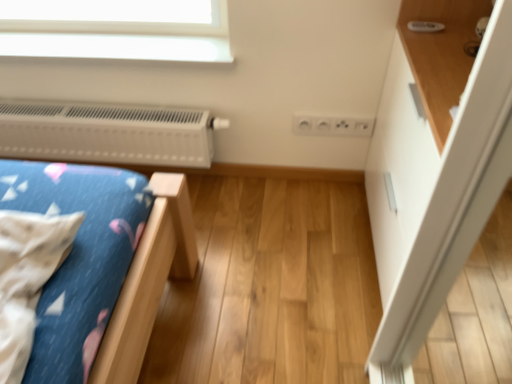
Image resolution: width=512 pixels, height=384 pixels. Describe the element at coordinates (441, 54) in the screenshot. I see `wooden shelf at upper right` at that location.

Find the location of a particular element. This screenshot has width=512, height=384. white glossy dresser at upper right is located at coordinates (414, 169).

At what (x,y) coordinates should I click in order to perform the action: click on white plastic heater at upper left. Please return your answer as a coordinate pair (x, y). Looking at the image, I should click on (108, 133).

Are white glossy dresser at upper right and white plastic heater at upper left located far from each other?

No, white glossy dresser at upper right is in close proximity to white plastic heater at upper left.

From a real-world perspective, is white glossy dresser at upper right positioned over white plastic heater at upper left based on gravity?

Yes, from a real-world perspective, white glossy dresser at upper right is over white plastic heater at upper left

Considering the relative positions of white plastic heater at upper left and wooden shelf at upper right in the image provided, is white plastic heater at upper left in front of wooden shelf at upper right?

No, it is behind wooden shelf at upper right.

Considering the relative sizes of white plastic heater at upper left and wooden shelf at upper right in the image provided, is white plastic heater at upper left shorter than wooden shelf at upper right?

Correct, white plastic heater at upper left is not as tall as wooden shelf at upper right.

Is white plastic heater at upper left positioned far away from wooden shelf at upper right?

Actually, white plastic heater at upper left and wooden shelf at upper right are a little close together.

Does white plastic heater at upper left have a smaller size compared to wooden shelf at upper right?

Correct, white plastic heater at upper left occupies less space than wooden shelf at upper right.

In the scene shown: How much distance is there between white plastic heater at upper left and white glossy dresser at upper right?

The distance of white plastic heater at upper left from white glossy dresser at upper right is 34.56 inches.

Is white plastic heater at upper left at the left side of white glossy dresser at upper right?

Yes.

Is white plastic heater at upper left oriented away from white glossy dresser at upper right?

No, white plastic heater at upper left is not facing away from white glossy dresser at upper right.

Is white plastic heater at upper left not within white glossy dresser at upper right?

That's correct, white plastic heater at upper left is outside of white glossy dresser at upper right.

Could you tell me if white glossy dresser at upper right is facing wooden shelf at upper right?

No.

Which object is further away from the camera taking this photo, white glossy dresser at upper right or wooden shelf at upper right?

Positioned behind is white glossy dresser at upper right.

Who is smaller, white glossy dresser at upper right or wooden shelf at upper right?

Smaller between the two is wooden shelf at upper right.

From the image's perspective, is white glossy dresser at upper right located above wooden shelf at upper right?

No, from the image's perspective, white glossy dresser at upper right is not above wooden shelf at upper right.

Considering the positions of objects wooden shelf at upper right and white glossy dresser at upper right in the image provided, who is more to the right, wooden shelf at upper right or white glossy dresser at upper right?

white glossy dresser at upper right is more to the right.

Is point (462, 60) farther from camera compared to point (446, 152)?

Yes.

Image resolution: width=512 pixels, height=384 pixels. In order to click on shelf above the white glossy dresser at upper right (from the image's perspective) in this screenshot , I will do `click(441, 54)`.

Which object is closer to the camera, wooden shelf at upper right or white glossy dresser at upper right?

Positioned in front is wooden shelf at upper right.

Is wooden shelf at upper right located outside white plastic heater at upper left?

Yes, wooden shelf at upper right is located beyond the bounds of white plastic heater at upper left.

Which of these two, wooden shelf at upper right or white plastic heater at upper left, stands shorter?

Standing shorter between the two is white plastic heater at upper left.

From a real-world perspective, does wooden shelf at upper right sit lower than white plastic heater at upper left?

No.

From the picture: Is wooden shelf at upper right in contact with white plastic heater at upper left?

No, wooden shelf at upper right is not making contact with white plastic heater at upper left.

Identify the location of dresser above the white plastic heater at upper left (from a real-world perspective). The width and height of the screenshot is (512, 384). (414, 169).

At what (x,y) coordinates should I click in order to perform the action: click on shelf above the white plastic heater at upper left (from the image's perspective). Please return your answer as a coordinate pair (x, y). Looking at the image, I should click on [x=441, y=54].

Which object lies nearer to the anchor point white glossy dresser at upper right, white plastic heater at upper left or wooden shelf at upper right?

wooden shelf at upper right.

Looking at the image, which one is located further to white glossy dresser at upper right, wooden shelf at upper right or white plastic heater at upper left?

white plastic heater at upper left is positioned further to the anchor white glossy dresser at upper right.

Estimate the real-world distances between objects in this image. Which object is further from wooden shelf at upper right, white glossy dresser at upper right or white plastic heater at upper left?

white plastic heater at upper left lies further to wooden shelf at upper right than the other object.

From the image, which object appears to be nearer to white plastic heater at upper left, white glossy dresser at upper right or wooden shelf at upper right?

Among the two, white glossy dresser at upper right is located nearer to white plastic heater at upper left.

Considering their positions, is white plastic heater at upper left positioned further to wooden shelf at upper right than white glossy dresser at upper right?

white plastic heater at upper left lies further to wooden shelf at upper right than the other object.

Looking at the image, which one is located further to white plastic heater at upper left, wooden shelf at upper right or white glossy dresser at upper right?

Among the two, wooden shelf at upper right is located further to white plastic heater at upper left.

At what (x,y) coordinates should I click in order to perform the action: click on shelf located between white plastic heater at upper left and white glossy dresser at upper right in the left-right direction. Please return your answer as a coordinate pair (x, y). Looking at the image, I should click on (441, 54).